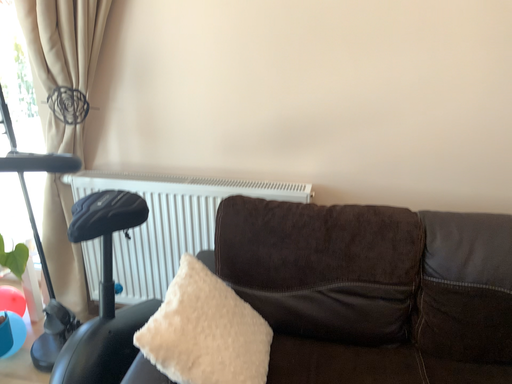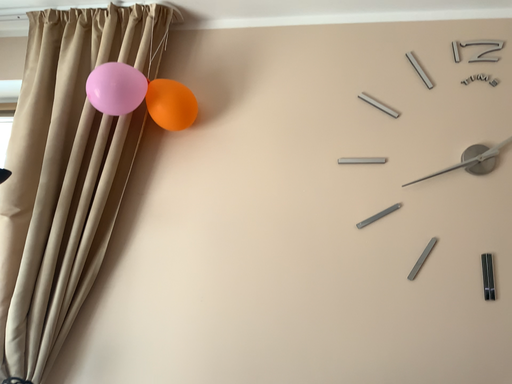
Question: How did the camera likely rotate when shooting the video?

Choices:
 (A) rotated right
 (B) rotated left

Answer: (A)